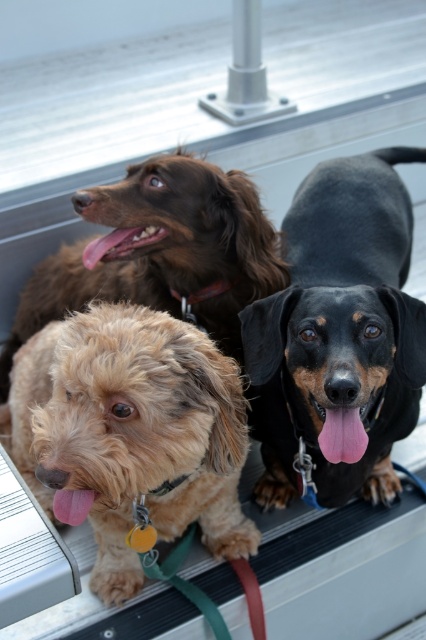
You are a photographer trying to capture a group photo of the light brown fur at center and the brown fuzzy dog at upper left. The minimum distance your camera can focus is 16 inches. Will you be able to take a clear photo of both subjects at the same time?

The light brown fur at center is 17.02 inches from the brown fuzzy dog at upper left. Since the minimum focusing distance is 16 inches, the camera can focus on both subjects as they are within the required distance.